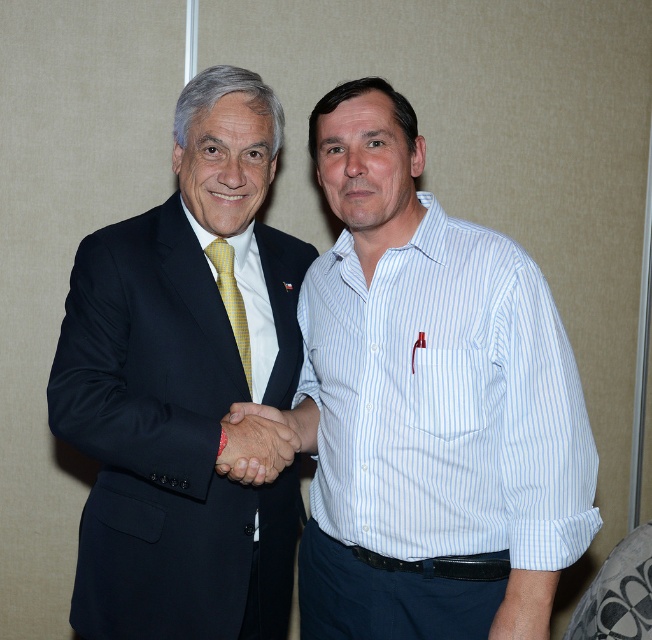
Can you confirm if smooth skin handshake at center is smaller than yellowtexturetie at center?

Actually, smooth skin handshake at center might be larger than yellowtexturetie at center.

Does point (297, 442) come farther from viewer compared to point (220, 243)?

No.

Locate an element on the screen. smooth skin handshake at center is located at coordinates (256, 444).

Which is in front, point (334, 180) or point (216, 243)?

Point (334, 180) is more forward.

Locate an element on the screen. The width and height of the screenshot is (652, 640). white striped shirt at center is located at coordinates (430, 404).

Is matte black suit at left wider than smooth skin handshake at center?

Yes.

Is point (209, 529) less distant than point (246, 438)?

That is False.

At what (x,y) coordinates should I click in order to perform the action: click on matte black suit at left. Please return your answer as a coordinate pair (x, y). Looking at the image, I should click on (185, 385).